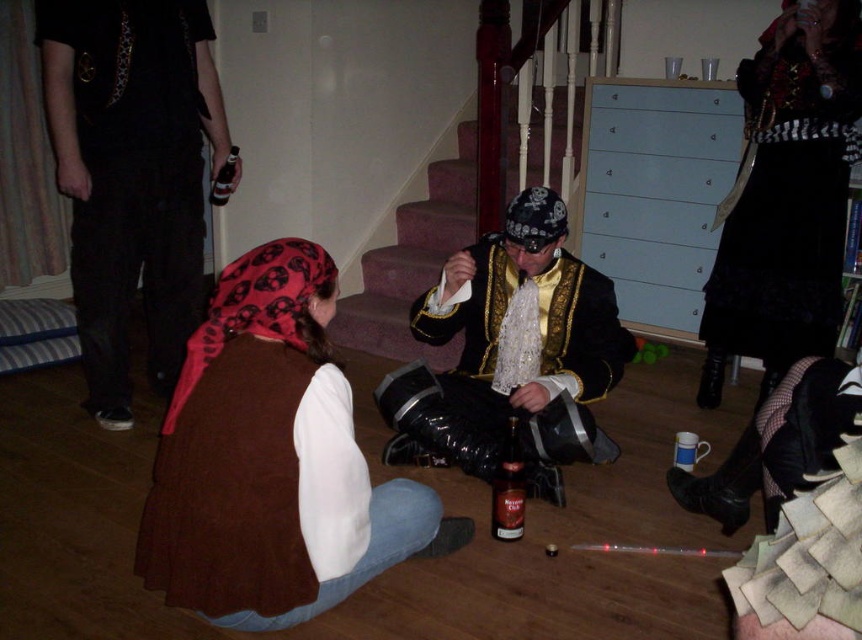
You are a photographer at this event and need to position your camera to capture both the brown fabric vest at lower left and the black lace skirt at lower right in the same frame. Which object should you focus on first to ensure both are in the frame?

The brown fabric vest at lower left is wider than the black lace skirt at lower right, so focusing on the vest first will help ensure both objects are included in the frame.

You are a photographer trying to capture a closeup of the brown fabric vest at lower left without the black lace skirt at lower right appearing in the background. Based on their positions, is this possible?

Yes, since the brown fabric vest at lower left is in front of the black lace skirt at lower right, you can focus on the vest and keep the skirt out of the frame by adjusting your angle to block the skirt behind the vest.

You are a guest at the party and want to compare the clothing items worn by the two people in the scene. Which clothing item is shorter in height between the brown fabric vest at lower left and the black cotton pants at upper left?

The brown fabric vest at lower left has a lesser height compared to the black cotton pants at upper left, so the brown fabric vest at lower left is shorter in height.